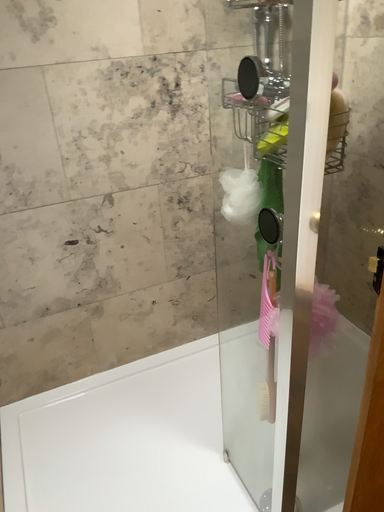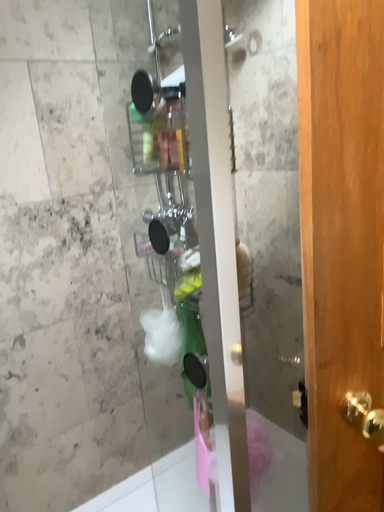
Question: How did the camera likely rotate when shooting the video?

Choices:
 (A) rotated left
 (B) rotated right

Answer: (B)